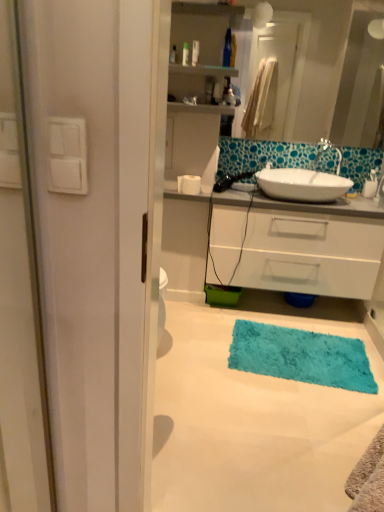
What do you see at coordinates (332, 70) in the screenshot? I see `white glossy mirror at upper center` at bounding box center [332, 70].

This screenshot has width=384, height=512. What are the coordinates of `white matte toilet paper at center` in the screenshot? It's located at (189, 184).

At what (x,y) coordinates should I click in order to perform the action: click on white glossy sink at center. Please return your answer as a coordinate pair (x, y). The width and height of the screenshot is (384, 512). Looking at the image, I should click on (304, 181).

Is white glossy mirror at upper center bigger than white glossy sink at center?

No.

Considering the relative sizes of white glossy mirror at upper center and white glossy sink at center in the image provided, is white glossy mirror at upper center taller than white glossy sink at center?

Yes, white glossy mirror at upper center is taller than white glossy sink at center.

Is white glossy mirror at upper center with white glossy sink at center?

There is a gap between white glossy mirror at upper center and white glossy sink at center.

Can white glossy sink at center be found inside white glossy mirror at upper center?

No, white glossy sink at center is located outside of white glossy mirror at upper center.

Which object is positioned more to the left, white glossy mirror at upper center or white matte toilet paper at center?

white matte toilet paper at center is more to the left.

From the image's perspective, which one is positioned higher, white glossy mirror at upper center or white matte toilet paper at center?

white glossy mirror at upper center appears higher in the image.

Who is taller, white glossy mirror at upper center or white matte toilet paper at center?

With more height is white glossy mirror at upper center.

Considering the positions of point (305, 454) and point (317, 55), is point (305, 454) closer or farther from the camera than point (317, 55)?

Clearly, point (305, 454) is closer to the camera than point (317, 55).

From the image's perspective, does turquoise shaggy rug at lower center appear lower than white glossy mirror at upper center?

Yes, from the image's perspective, turquoise shaggy rug at lower center is beneath white glossy mirror at upper center.

From a real-world perspective, is turquoise shaggy rug at lower center positioned over white glossy mirror at upper center based on gravity?

Incorrect, from a real-world perspective, turquoise shaggy rug at lower center is lower than white glossy mirror at upper center.

Is turquoise shaggy rug at lower center not near translucent plastic bottle at upper center?

Indeed, turquoise shaggy rug at lower center is not near translucent plastic bottle at upper center.

Is translucent plastic bottle at upper center completely or partially inside turquoise shaggy rug at lower center?

No, turquoise shaggy rug at lower center does not contain translucent plastic bottle at upper center.

Based on the photo, could you measure the distance between turquoise shaggy rug at lower center and translucent plastic bottle at upper center?

A distance of 5.82 feet exists between turquoise shaggy rug at lower center and translucent plastic bottle at upper center.

Between turquoise shaggy rug at lower center and translucent plastic bottle at upper center, which one has larger size?

With larger size is turquoise shaggy rug at lower center.

Which is more to the right, white glossy sink at center or turquoise shaggy bath mat at lower center?

white glossy sink at center.

Based on the photo, from the image's perspective, which is above, white glossy sink at center or turquoise shaggy bath mat at lower center?

white glossy sink at center appears higher in the image.

Does white glossy sink at center have a smaller size compared to turquoise shaggy bath mat at lower center?

Actually, white glossy sink at center might be larger than turquoise shaggy bath mat at lower center.

In terms of height, does white matte toilet paper at center look taller or shorter compared to turquoise shaggy rug at lower center?

Considering their sizes, white matte toilet paper at center has more height than turquoise shaggy rug at lower center.

Considering the relative positions of white matte toilet paper at center and turquoise shaggy rug at lower center in the image provided, is white matte toilet paper at center to the left or to the right of turquoise shaggy rug at lower center?

Clearly, white matte toilet paper at center is on the left of turquoise shaggy rug at lower center in the image.

Locate an element on the screen. toilet paper behind the turquoise shaggy rug at lower center is located at coordinates (189, 184).

Relative to turquoise shaggy bath mat at lower center, is turquoise shaggy rug at lower center in front or behind?

turquoise shaggy rug at lower center is in front of turquoise shaggy bath mat at lower center.

Could you tell me if turquoise shaggy rug at lower center is facing turquoise shaggy bath mat at lower center?

Yes.

This screenshot has width=384, height=512. Identify the location of plain that appears below the turquoise shaggy bath mat at lower center (from a real-world perspective). (253, 422).

At what (x,y) coordinates should I click in order to perform the action: click on sink lying below the white glossy mirror at upper center (from the image's perspective). Please return your answer as a coordinate pair (x, y). Image resolution: width=384 pixels, height=512 pixels. Looking at the image, I should click on (304, 181).

This screenshot has width=384, height=512. What are the coordinates of `mirror that appears on the right of white matte toilet paper at center` in the screenshot? It's located at (332, 70).

Looking at the image, which one is located further to white glossy sink at center, turquoise shaggy bath mat at lower center or translucent plastic bottle at upper center?

Among the two, turquoise shaggy bath mat at lower center is located further to white glossy sink at center.

Considering their positions, is white glossy sink at center positioned closer to turquoise shaggy rug at lower center than white matte toilet paper at center?

white glossy sink at center lies closer to turquoise shaggy rug at lower center than the other object.

Looking at the image, which one is located further to white glossy sink at center, turquoise shaggy rug at lower center or white matte toilet paper at center?

turquoise shaggy rug at lower center.

Considering their positions, is white glossy cabinet at center positioned further to translucent plastic bottle at upper center than turquoise shaggy bath mat at lower center?

turquoise shaggy bath mat at lower center is further to translucent plastic bottle at upper center.

When comparing their distances from white glossy mirror at upper center, does turquoise shaggy bath mat at lower center or white matte toilet paper at center seem further?

The object further to white glossy mirror at upper center is turquoise shaggy bath mat at lower center.

Estimate the real-world distances between objects in this image. Which object is further from white glossy cabinet at center, white glossy sink at center or turquoise shaggy rug at lower center?

turquoise shaggy rug at lower center lies further to white glossy cabinet at center than the other object.

Considering their positions, is white glossy cabinet at center positioned closer to white glossy sink at center than white matte toilet paper at center?

white glossy cabinet at center.

Estimate the real-world distances between objects in this image. Which object is further from white matte toilet paper at center, white glossy cabinet at center or white glossy sink at center?

white glossy sink at center is positioned further to the anchor white matte toilet paper at center.

Find the location of a particular element. This screenshot has height=512, width=384. bathroom cabinet between turquoise shaggy rug at lower center and white matte toilet paper at center from front to back is located at coordinates (314, 243).

The height and width of the screenshot is (512, 384). Find the location of `toilet paper between white glossy mirror at upper center and turquoise shaggy bath mat at lower center from top to bottom`. toilet paper between white glossy mirror at upper center and turquoise shaggy bath mat at lower center from top to bottom is located at coordinates (189, 184).

Locate an element on the screen. bath mat between translucent plastic bottle at upper center and turquoise shaggy rug at lower center in the up-down direction is located at coordinates (301, 356).

Locate an element on the screen. bath mat between white matte toilet paper at center and turquoise shaggy rug at lower center in the up-down direction is located at coordinates (301, 356).